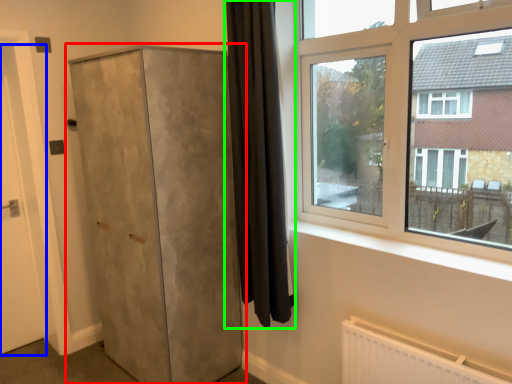
Question: Considering the real-world distances, which object is closest to cupboard (highlighted by a red box)? door (highlighted by a blue box) or curtain (highlighted by a green box).

Choices:
 (A) door
 (B) curtain

Answer: (B)